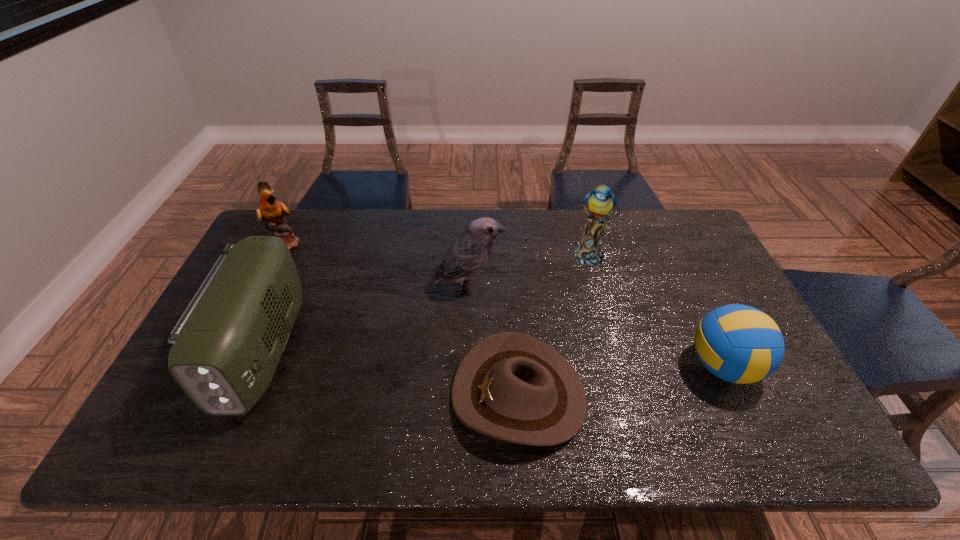
Locate an element on the screen. The image size is (960, 540). empty space between the leftmost parrot and the nearest parrot is located at coordinates (377, 265).

Find the location of a particular element. This screenshot has height=540, width=960. free point between the nearest parrot and the rightmost object is located at coordinates (595, 327).

You are a GUI agent. You are given a task and a screenshot of the screen. Output one action in this format:
    pyautogui.click(x=<x>, y=<y>)
    Task: Click on the free spot between the radio_receiver and the shortest object
    The image size is (960, 540).
    Given the screenshot: What is the action you would take?
    pyautogui.click(x=391, y=373)

The height and width of the screenshot is (540, 960). Identify the location of free space that is in between the fifth object from left to right and the radio_receiver. (426, 303).

At what (x,y) coordinates should I click in order to perform the action: click on vacant region between the fifth tallest object and the nearest parrot. Please return your answer as a coordinate pair (x, y). This screenshot has height=540, width=960. Looking at the image, I should click on (595, 327).

This screenshot has width=960, height=540. Find the location of `free space between the rightmost parrot and the radio_receiver`. free space between the rightmost parrot and the radio_receiver is located at coordinates (426, 303).

I want to click on object that stands as the third closest to the fifth tallest object, so click(x=469, y=253).

This screenshot has width=960, height=540. What are the coordinates of `the second closest object to the second parrot from left to right` in the screenshot? It's located at (599, 203).

I want to click on parrot that is the third closest one to the radio_receiver, so click(599, 203).

Where is `parrot object that ranks as the closest to the leftmost parrot`? The width and height of the screenshot is (960, 540). parrot object that ranks as the closest to the leftmost parrot is located at coordinates (469, 253).